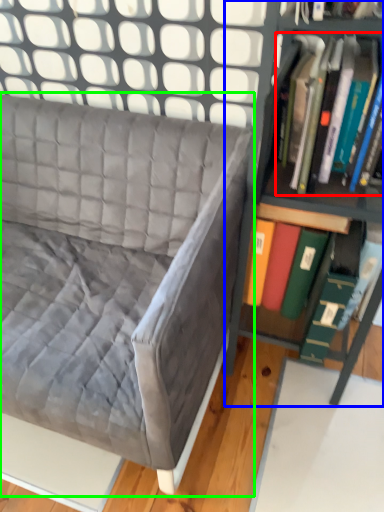
Question: Which object is positioned farthest from book (highlighted by a red box)? Select from shelf (highlighted by a blue box) and studio couch (highlighted by a green box).

Choices:
 (A) shelf
 (B) studio couch

Answer: (B)